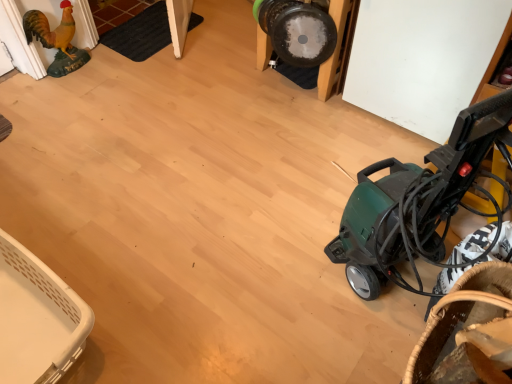
Question: Considering their positions, is green plastic vacuum cleaner at right located in front of or behind brown woven basket at lower right, arranged as the 1th basket when viewed from the front?

Choices:
 (A) behind
 (B) front

Answer: (B)

Question: Is green plastic vacuum cleaner at right inside the boundaries of brown woven basket at lower right, arranged as the 1th basket when viewed from the front, or outside?

Choices:
 (A) outside
 (B) inside

Answer: (A)

Question: Estimate the real-world distances between objects in this image. Which object is closer to the golden matte chicken at left?

Choices:
 (A) green plastic vacuum cleaner at right
 (B) brown woven basket at lower right, arranged as the 1th basket when viewed from the front
 (C) white plastic basket at lower left, the second basket when ordered from right to left

Answer: (C)

Question: Considering the real-world distances, which object is farthest from the golden matte chicken at left?

Choices:
 (A) brown woven basket at lower right, placed as the 1th basket when sorted from right to left
 (B) green plastic vacuum cleaner at right
 (C) white plastic basket at lower left, which is counted as the first basket, starting from the left

Answer: (A)